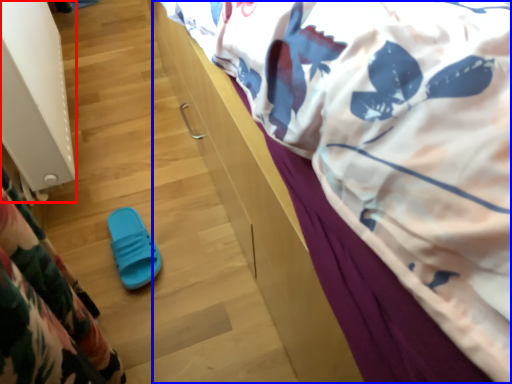
Question: Which point is closer to the camera, radiator (highlighted by a red box) or bed (highlighted by a blue box)?

Choices:
 (A) radiator
 (B) bed

Answer: (B)